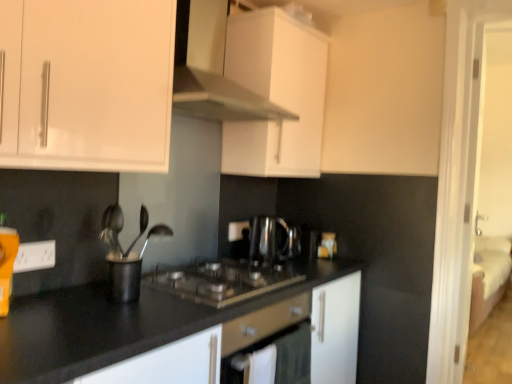
Question: Is black matte utensil holder at center far from black granite countertop at center?

Choices:
 (A) yes
 (B) no

Answer: (B)

Question: Considering the relative sizes of black matte utensil holder at center and black granite countertop at center in the image provided, is black matte utensil holder at center wider than black granite countertop at center?

Choices:
 (A) no
 (B) yes

Answer: (A)

Question: Can you confirm if black matte utensil holder at center is positioned to the right of black granite countertop at center?

Choices:
 (A) no
 (B) yes

Answer: (A)

Question: Is black granite countertop at center completely or partially inside black matte utensil holder at center?

Choices:
 (A) yes
 (B) no

Answer: (B)

Question: Is black matte utensil holder at center positioned beyond the bounds of black granite countertop at center?

Choices:
 (A) yes
 (B) no

Answer: (A)

Question: Is black granite countertop at center at the back of black matte utensil holder at center?

Choices:
 (A) yes
 (B) no

Answer: (B)

Question: Is satin black coffee machine at center oriented away from black matte utensil holder at center?

Choices:
 (A) no
 (B) yes

Answer: (A)

Question: Can you confirm if satin black coffee machine at center is wider than black matte utensil holder at center?

Choices:
 (A) yes
 (B) no

Answer: (A)

Question: From the image's perspective, is satin black coffee machine at center located beneath black matte utensil holder at center?

Choices:
 (A) no
 (B) yes

Answer: (A)

Question: Can you confirm if satin black coffee machine at center is bigger than black matte utensil holder at center?

Choices:
 (A) no
 (B) yes

Answer: (B)

Question: Is satin black coffee machine at center shorter than black matte utensil holder at center?

Choices:
 (A) yes
 (B) no

Answer: (B)

Question: Considering the relative sizes of satin black coffee machine at center and black matte utensil holder at center in the image provided, is satin black coffee machine at center smaller than black matte utensil holder at center?

Choices:
 (A) yes
 (B) no

Answer: (B)

Question: Is black granite countertop at center far from white plastic electrical outlet at lower left?

Choices:
 (A) no
 (B) yes

Answer: (A)